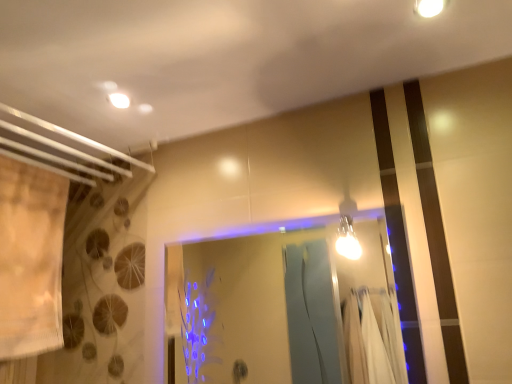
Question: Can you confirm if white glossy light fixture at upper right, arranged as the first light fixture when viewed from the right, is smaller than beige fabric shower curtain at left?

Choices:
 (A) no
 (B) yes

Answer: (B)

Question: From a real-world perspective, is white glossy light fixture at upper right, the second light fixture from the left, under beige fabric shower curtain at left?

Choices:
 (A) no
 (B) yes

Answer: (A)

Question: From the image's perspective, would you say white glossy light fixture at upper right, the second light fixture from the left, is positioned over beige fabric shower curtain at left?

Choices:
 (A) no
 (B) yes

Answer: (B)

Question: Does white glossy light fixture at upper right, arranged as the first light fixture when viewed from the right, have a lesser height compared to beige fabric shower curtain at left?

Choices:
 (A) yes
 (B) no

Answer: (A)

Question: Does white glossy light fixture at upper right, the second light fixture from the left, appear on the left side of beige fabric shower curtain at left?

Choices:
 (A) no
 (B) yes

Answer: (A)

Question: Is white glossy light fixture at upper right, the 2th light fixture positioned from the bottom, taller or shorter than matte white light fixture at upper left?

Choices:
 (A) short
 (B) tall

Answer: (B)

Question: Considering their positions, is white glossy light fixture at upper right, arranged as the first light fixture when viewed from the right, located in front of or behind matte white light fixture at upper left?

Choices:
 (A) front
 (B) behind

Answer: (A)

Question: In terms of width, does white glossy light fixture at upper right, which is the first light fixture from front to back, look wider or thinner when compared to matte white light fixture at upper left?

Choices:
 (A) thin
 (B) wide

Answer: (B)

Question: Is point (417, 11) closer or farther from the camera than point (114, 99)?

Choices:
 (A) closer
 (B) farther

Answer: (A)

Question: Considering their positions, is transparent glass door at center located in front of or behind white glossy light fixture at upper right, positioned as the 2th light fixture in back-to-front order?

Choices:
 (A) front
 (B) behind

Answer: (B)

Question: Considering the positions of transparent glass door at center and white glossy light fixture at upper right, the 2th light fixture positioned from the bottom, in the image, is transparent glass door at center bigger or smaller than white glossy light fixture at upper right, the 2th light fixture positioned from the bottom,?

Choices:
 (A) big
 (B) small

Answer: (A)

Question: In terms of height, does transparent glass door at center look taller or shorter compared to white glossy light fixture at upper right, arranged as the first light fixture when viewed from the right?

Choices:
 (A) tall
 (B) short

Answer: (A)

Question: Does point (293, 331) appear closer or farther from the camera than point (423, 8)?

Choices:
 (A) closer
 (B) farther

Answer: (B)

Question: Considering the positions of transparent glass door at center and matte white light fixture at upper left in the image, is transparent glass door at center bigger or smaller than matte white light fixture at upper left?

Choices:
 (A) big
 (B) small

Answer: (A)

Question: From the image's perspective, is transparent glass door at center positioned above or below matte white light fixture at upper left?

Choices:
 (A) below
 (B) above

Answer: (A)